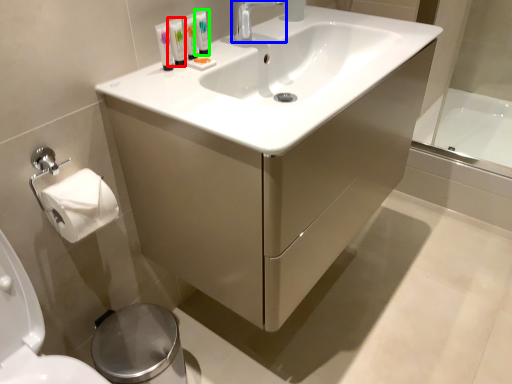
Question: Which is nearer to the mouthwash (highlighted by a red box)? tap (highlighted by a blue box) or mouthwash (highlighted by a green box).

Choices:
 (A) tap
 (B) mouthwash

Answer: (B)